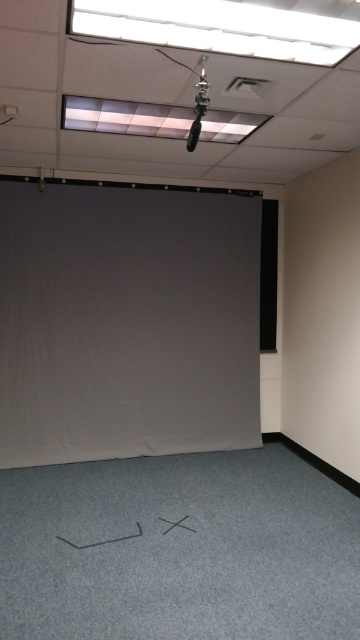
Question: Is gray matte projection screen at center positioned at the back of black matte projector screen at right?

Choices:
 (A) yes
 (B) no

Answer: (B)

Question: Which point is closer to the camera taking this photo?

Choices:
 (A) (272, 248)
 (B) (83, 452)

Answer: (B)

Question: In this image, where is gray matte projection screen at center located relative to black matte projector screen at right?

Choices:
 (A) right
 (B) left

Answer: (B)

Question: Which point is closer to the camera?

Choices:
 (A) (266, 301)
 (B) (95, 314)

Answer: (B)

Question: Which object appears farthest from the camera in this image?

Choices:
 (A) black matte projector screen at right
 (B) gray matte projection screen at center

Answer: (A)

Question: In this image, where is gray matte projection screen at center located relative to black matte projector screen at right?

Choices:
 (A) right
 (B) left

Answer: (B)